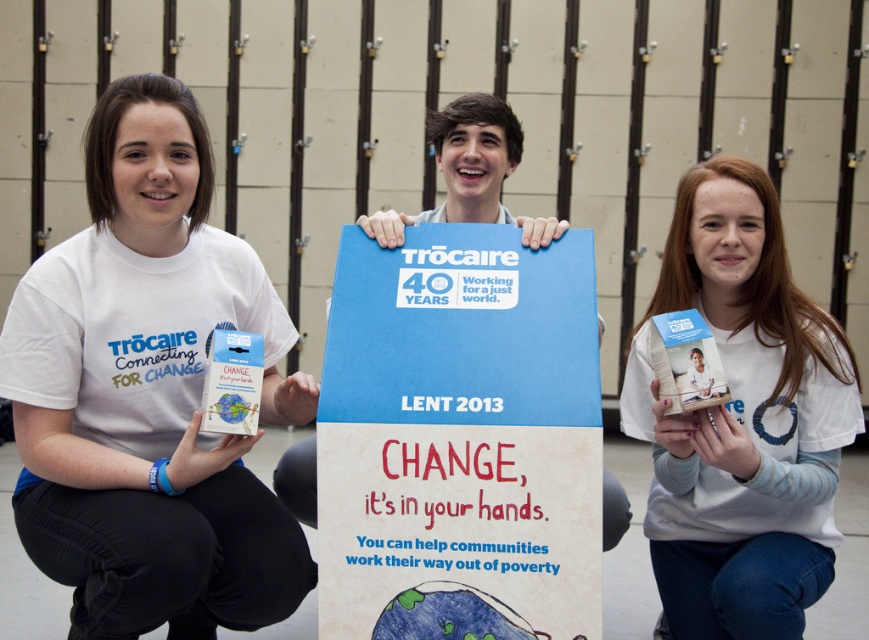
Question: Is the position of white matte t-shirt at left less distant than that of white matte book at center?

Choices:
 (A) yes
 (B) no

Answer: (A)

Question: Does white matte book at center appear under blue cardboard poster at center?

Choices:
 (A) no
 (B) yes

Answer: (B)

Question: Which point appears closest to the camera in this image?

Choices:
 (A) (798, 340)
 (B) (436, 138)
 (C) (149, 524)

Answer: (C)

Question: Which object is positioned farthest from the blue cardboard poster at center?

Choices:
 (A) white matte book at center
 (B) white matte t-shirt at left

Answer: (B)

Question: Is the position of white matte t-shirt at left less distant than that of white matte book at center?

Choices:
 (A) yes
 (B) no

Answer: (A)

Question: Which point is closer to the camera?

Choices:
 (A) white matte book at center
 (B) blue cardboard poster at center
 (C) white matte t-shirt at left

Answer: (C)